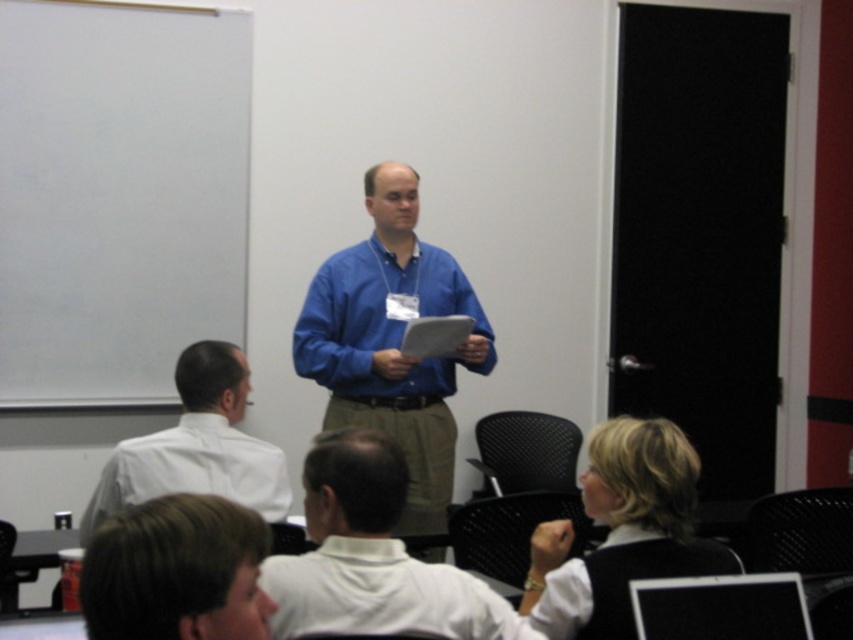
In the scene, you see a blue fabric shirt at center and a brown hair at lower center. Which object is positioned to the right of the other?

The blue fabric shirt at center is positioned to the right of brown hair at lower center.

In the classroom scene, you are asked to identify which object is smaller between the brown hair at lower center and the black fabric vest at lower right. Can you determine which one is smaller?

The brown hair at lower center has a smaller size compared to the black fabric vest at lower right, so the brown hair at lower center is smaller.